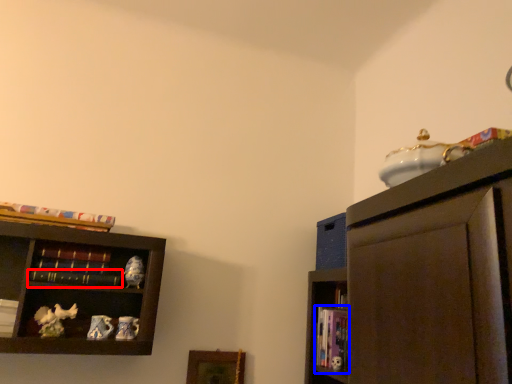
Question: Which object is further to the camera taking this photo, book (highlighted by a red box) or book (highlighted by a blue box)?

Choices:
 (A) book
 (B) book

Answer: (B)